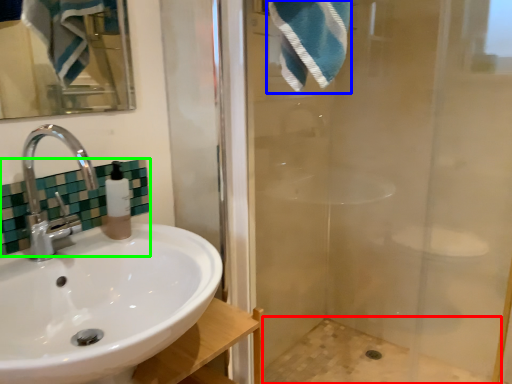
Question: Which object is the closest to the bath (highlighted by a red box)? Choose among these: bath towel (highlighted by a blue box) or tile (highlighted by a green box).

Choices:
 (A) bath towel
 (B) tile

Answer: (B)